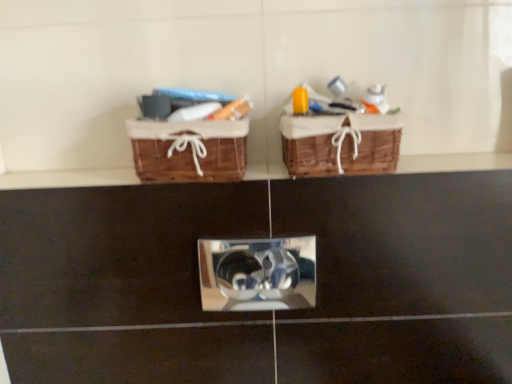
This screenshot has height=384, width=512. I want to click on empty space that is ontop of woven brown picnic basket at upper center, the second picnic basket when ordered from left to right (from a real-world perspective), so click(341, 108).